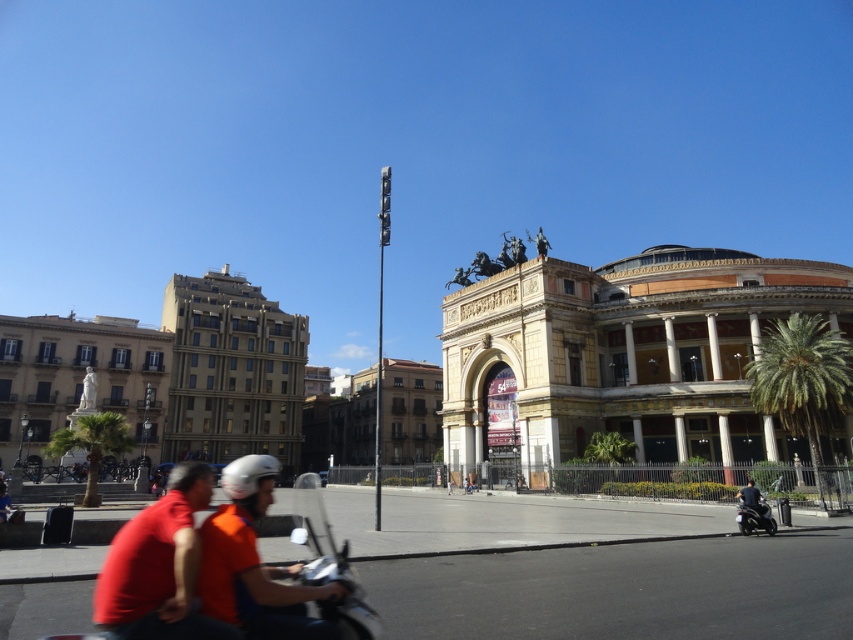
Does orange fabric helmet at center have a greater width compared to green leafy palm at right?

Correct, the width of orange fabric helmet at center exceeds that of green leafy palm at right.

Is point (343, 595) positioned before point (788, 316)?

That is True.

Locate an element on the screen. The image size is (853, 640). orange fabric helmet at center is located at coordinates (256, 564).

Which is below, orange fabric helmet at center or red fabric shirt at lower left?

orange fabric helmet at center

Measure the distance between orange fabric helmet at center and camera.

17.86 meters

The height and width of the screenshot is (640, 853). I want to click on orange fabric helmet at center, so click(256, 564).

At what (x,y) coordinates should I click in order to perform the action: click on orange fabric helmet at center. Please return your answer as a coordinate pair (x, y). Looking at the image, I should click on (256, 564).

Is point (144, 522) behind point (744, 502)?

No.

Between red fabric shirt at lower left and dark gray fabric jacket at lower right, which one is positioned lower?

dark gray fabric jacket at lower right is lower down.

Measure the distance between point (177, 512) and camera.

The distance of point (177, 512) from camera is 63.38 feet.

I want to click on red fabric shirt at lower left, so click(160, 566).